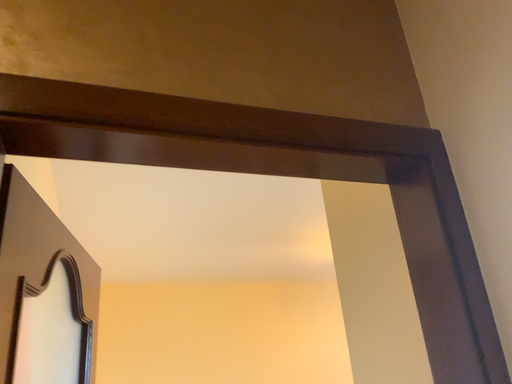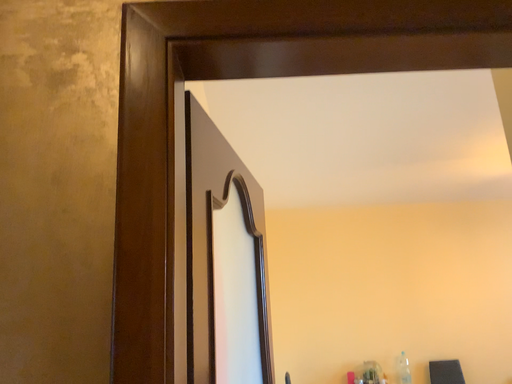
Question: Which way did the camera rotate in the video?

Choices:
 (A) rotated left
 (B) rotated right

Answer: (A)